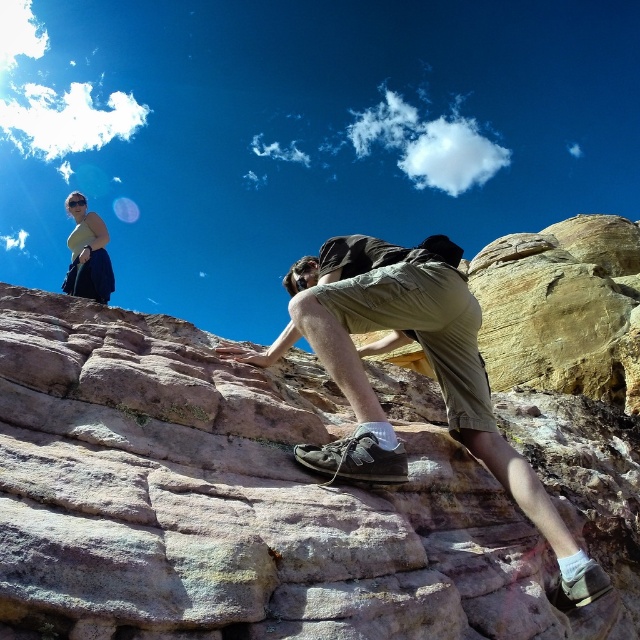
Question: Which object is closer to the camera taking this photo?

Choices:
 (A) matte yellow top at upper left
 (B) matte khaki shorts at center

Answer: (B)

Question: Is matte khaki shorts at center positioned at the back of matte yellow top at upper left?

Choices:
 (A) no
 (B) yes

Answer: (A)

Question: Among these points, which one is nearest to the camera?

Choices:
 (A) (307, 452)
 (B) (99, 268)

Answer: (A)

Question: Is the position of matte khaki shorts at center less distant than that of matte yellow top at upper left?

Choices:
 (A) no
 (B) yes

Answer: (B)

Question: Is the position of matte khaki shorts at center less distant than that of matte yellow top at upper left?

Choices:
 (A) yes
 (B) no

Answer: (A)

Question: Which point appears closest to the camera in this image?

Choices:
 (A) (374, 480)
 (B) (93, 294)

Answer: (A)